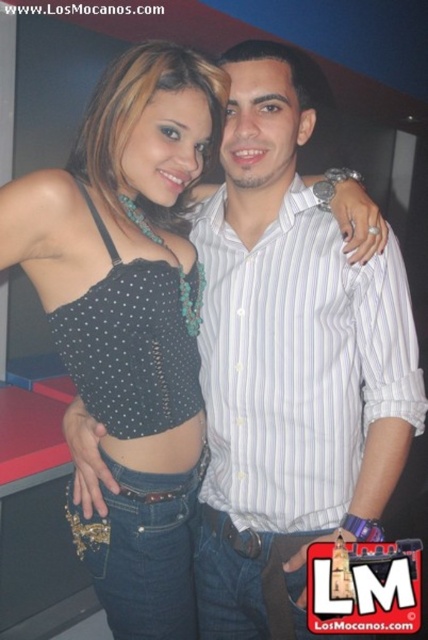
You are a photographer adjusting your camera to focus on the black matte tank top at center and the white striped shirt at center. Which one should you focus on first to ensure proper depth of field?

The black matte tank top at center is closer to the viewer than the white striped shirt at center, so you should focus on the black matte tank top at center first to ensure proper depth of field.

You are a photographer trying to capture a clear shot of the two people in the image. You notice that the black matte tank top at center and the white striped shirt at center are overlapping. Which clothing item is more likely to be fully visible in the photo?

The black matte tank top at center is much taller than the white striped shirt at center, so it is more likely to be fully visible in the photo.